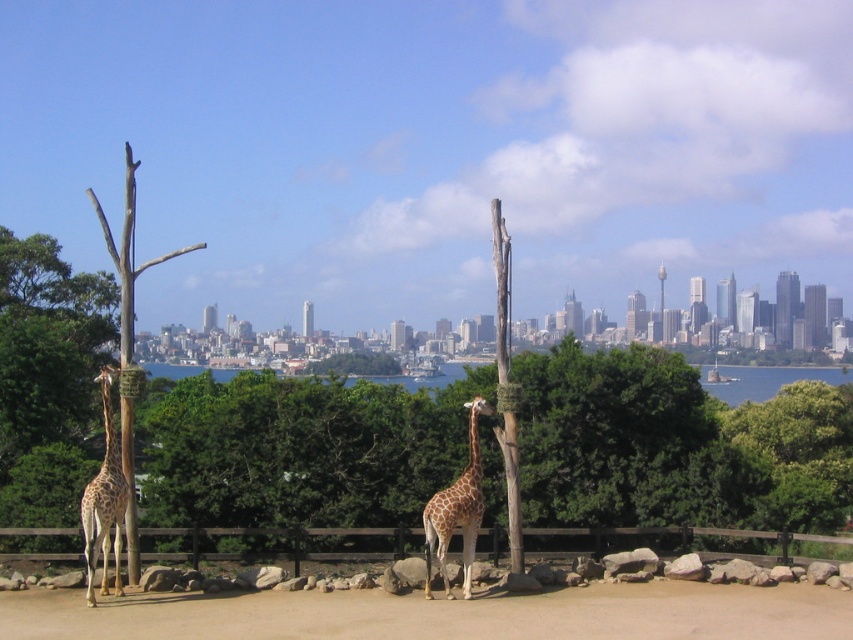
Question: Is brown wooden fence at center wider than spotted fur giraffe at left?

Choices:
 (A) yes
 (B) no

Answer: (A)

Question: Is brown sandy dirt at center further to camera compared to spotted brown giraffe at center?

Choices:
 (A) yes
 (B) no

Answer: (B)

Question: Is spotted fur giraffe at left positioned behind spotted brown giraffe at center?

Choices:
 (A) yes
 (B) no

Answer: (B)

Question: Which point is closer to the camera?

Choices:
 (A) brown wooden fence at center
 (B) spotted brown giraffe at center
 (C) spotted fur giraffe at left
 (D) brown sandy dirt at center

Answer: (C)

Question: Which of the following is the farthest from the observer?

Choices:
 (A) spotted fur giraffe at left
 (B) spotted brown giraffe at center

Answer: (B)

Question: Which of these objects is positioned farthest from the brown wooden fence at center?

Choices:
 (A) brown sandy dirt at center
 (B) spotted fur giraffe at left

Answer: (A)